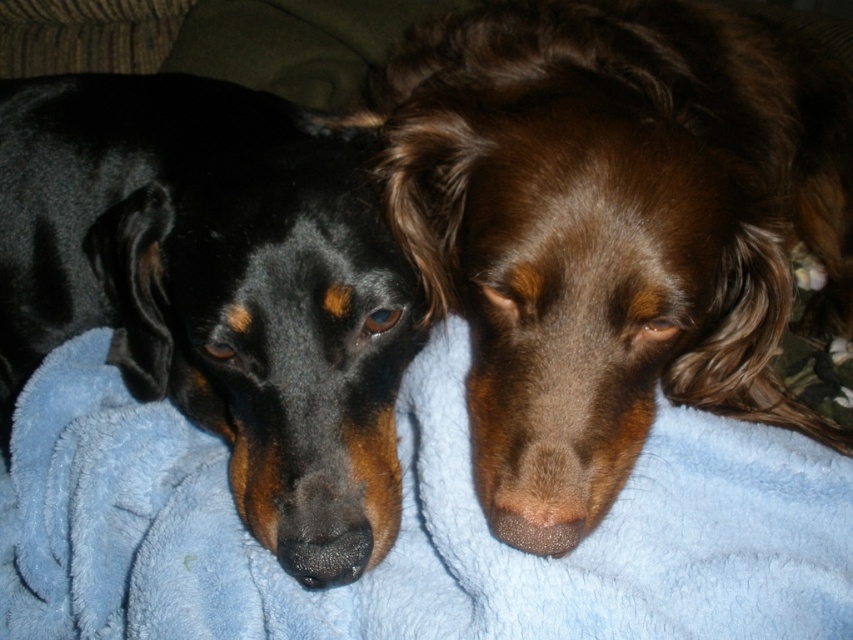
You are a pet photographer and need to position a toy between the blue fleece blanket at center and the black fur dog at left. Where should you place the toy so it is closer to the blanket than the dog?

The blue fleece blanket at center is to the right of the black fur dog at left. To place the toy closer to the blanket than the dog, position it to the right side of the blanket.

You are a photographer trying to capture a closeup shot of the brown furry dog at center. However, the black fur dog at left is blocking your view. Can you adjust your position to get a clear shot without moving any dogs?

The brown furry dog at center is closer to the viewer than the black fur dog at left, so you can move your position slightly to the right to get a clear shot of the brown furry dog at center without obstruction from the black fur dog at left.

You are standing in front of the image and notice a point marked at coordinates (614, 228). Which dog does this point indicate?

The point at coordinates (614, 228) corresponds to the brown furry dog at center.